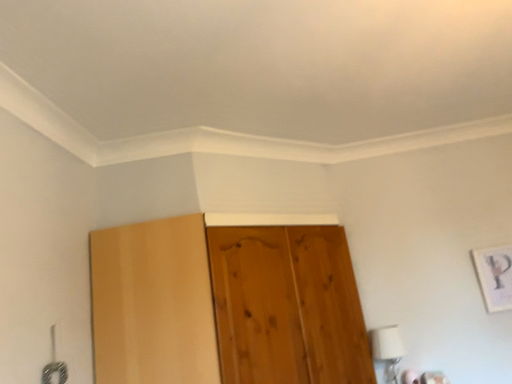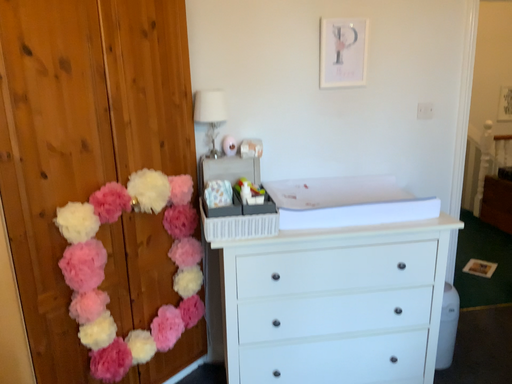
Question: How did the camera likely rotate when shooting the video?

Choices:
 (A) rotated downward
 (B) rotated upward

Answer: (A)